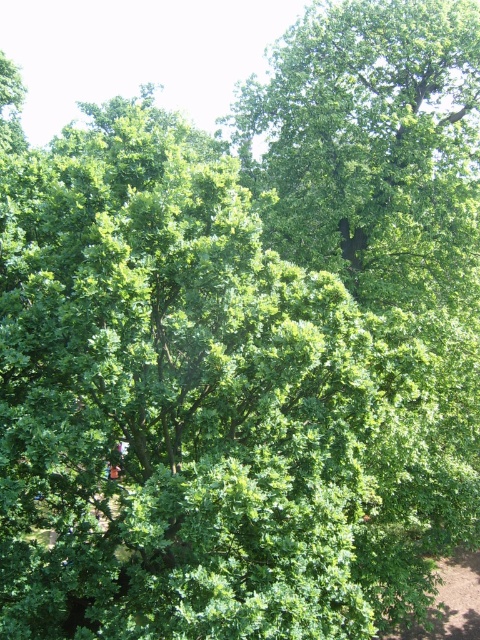
You are standing on the brown dirt path at lower right and looking up. Which direction should you look to see the green leafy tree at upper center?

You should look upward because the green leafy tree at upper center is above the brown dirt path at lower right.

You are a hiker standing on the brown dirt path at lower right and want to reach the green leafy tree at upper center. Which direction should you move to get closer to the tree?

The green leafy tree at upper center is smaller than the brown dirt path at lower right, which suggests that the tree is farther away from the observer. To get closer to the tree, you should move forward towards the upper center direction where the tree is located.

You are standing on the brown dirt path at lower right and want to reach the green leafy tree at upper center. Which direction should you move to get closer to the tree?

Since the green leafy tree at upper center is further to the viewer than the brown dirt path at lower right, you are already closer to the tree than the path. To reach the tree, you should move forward towards it from the brown dirt path at lower right.